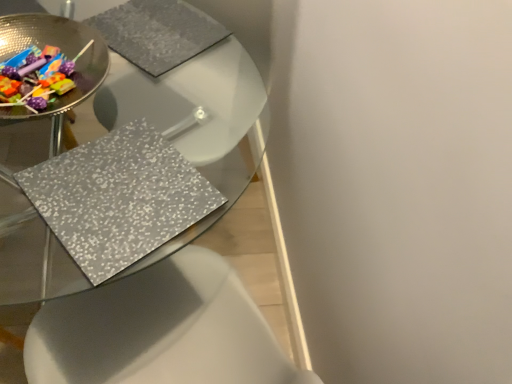
What are the coordinates of `shiny metallic bowl at upper left` in the screenshot? It's located at (61, 50).

What do you see at coordinates (61, 50) in the screenshot? Image resolution: width=512 pixels, height=384 pixels. I see `shiny metallic bowl at upper left` at bounding box center [61, 50].

The width and height of the screenshot is (512, 384). In order to click on metallic silver placemat at center in this screenshot , I will do click(184, 117).

This screenshot has height=384, width=512. What do you see at coordinates (184, 117) in the screenshot? I see `metallic silver placemat at center` at bounding box center [184, 117].

Locate an element on the screen. The image size is (512, 384). shiny metallic bowl at upper left is located at coordinates coord(61,50).

Between metallic silver placemat at center and shiny metallic bowl at upper left, which one appears on the right side from the viewer's perspective?

From the viewer's perspective, shiny metallic bowl at upper left appears more on the right side.

Does metallic silver placemat at center lie behind shiny metallic bowl at upper left?

No, it is not.

Considering the positions of point (224, 50) and point (71, 25), is point (224, 50) closer or farther from the camera than point (71, 25)?

Point (224, 50) appears to be farther away from the viewer than point (71, 25).

From the image's perspective, is metallic silver placemat at center located beneath shiny metallic bowl at upper left?

Yes, from the image's perspective, metallic silver placemat at center is below shiny metallic bowl at upper left.

From a real-world perspective, which object stands above the other?

From a 3D spatial view, shiny metallic bowl at upper left is above.

In terms of width, does metallic silver placemat at center look wider or thinner when compared to shiny metallic bowl at upper left?

In the image, metallic silver placemat at center appears to be wider than shiny metallic bowl at upper left.

From their relative heights in the image, would you say metallic silver placemat at center is taller or shorter than shiny metallic bowl at upper left?

metallic silver placemat at center is taller than shiny metallic bowl at upper left.

In terms of size, does metallic silver placemat at center appear bigger or smaller than shiny metallic bowl at upper left?

Clearly, metallic silver placemat at center is larger in size than shiny metallic bowl at upper left.

Do you think metallic silver placemat at center is within shiny metallic bowl at upper left, or outside of it?

metallic silver placemat at center is outside shiny metallic bowl at upper left.

Is metallic silver placemat at center far away from shiny metallic bowl at upper left?

No.

Does metallic silver placemat at center turn towards shiny metallic bowl at upper left?

No.

How different are the orientations of metallic silver placemat at center and shiny metallic bowl at upper left in degrees?

metallic silver placemat at center and shiny metallic bowl at upper left are facing 1.8 degrees away from each other.

You are a GUI agent. You are given a task and a screenshot of the screen. Output one action in this format:
    pyautogui.click(x=<x>, y=<y>)
    Task: Click on the table below the shiny metallic bowl at upper left (from a real-world perspective)
    This screenshot has height=384, width=512.
    Given the screenshot: What is the action you would take?
    pyautogui.click(x=184, y=117)

Considering the relative positions of shiny metallic bowl at upper left and metallic silver placemat at center in the image provided, is shiny metallic bowl at upper left to the right of metallic silver placemat at center from the viewer's perspective?

Correct, you'll find shiny metallic bowl at upper left to the right of metallic silver placemat at center.

Between shiny metallic bowl at upper left and metallic silver placemat at center, which one is positioned in front?

metallic silver placemat at center is more forward.

Considering the points (88, 82) and (42, 289), which point is in front, point (88, 82) or point (42, 289)?

The point (88, 82) is closer.

From the image's perspective, would you say shiny metallic bowl at upper left is shown under metallic silver placemat at center?

No, from the image's perspective, shiny metallic bowl at upper left is not beneath metallic silver placemat at center.

From a real-world perspective, is shiny metallic bowl at upper left on top of metallic silver placemat at center?

Indeed, from a real-world perspective, shiny metallic bowl at upper left stands above metallic silver placemat at center.

Between shiny metallic bowl at upper left and metallic silver placemat at center, which one has larger width?

Wider between the two is metallic silver placemat at center.

Between shiny metallic bowl at upper left and metallic silver placemat at center, which one has less height?

With less height is shiny metallic bowl at upper left.

Based on their sizes in the image, would you say shiny metallic bowl at upper left is bigger or smaller than metallic silver placemat at center?

Considering their sizes, shiny metallic bowl at upper left takes up less space than metallic silver placemat at center.

Is shiny metallic bowl at upper left completely or partially outside of metallic silver placemat at center?

shiny metallic bowl at upper left is positioned outside metallic silver placemat at center.

Is shiny metallic bowl at upper left with metallic silver placemat at center?

No, shiny metallic bowl at upper left is not next to metallic silver placemat at center.

Could you tell me if shiny metallic bowl at upper left is turned towards metallic silver placemat at center?

No.

What's the angular difference between shiny metallic bowl at upper left and metallic silver placemat at center's facing directions?

The angle between the facing direction of shiny metallic bowl at upper left and the facing direction of metallic silver placemat at center is 1.8 degrees.

How distant is shiny metallic bowl at upper left from metallic silver placemat at center?

The distance of shiny metallic bowl at upper left from metallic silver placemat at center is 16.52 inches.

At what (x,y) coordinates should I click in order to perform the action: click on table located on the left of shiny metallic bowl at upper left. Please return your answer as a coordinate pair (x, y). This screenshot has width=512, height=384. Looking at the image, I should click on (184, 117).

In order to click on table to the left of shiny metallic bowl at upper left in this screenshot , I will do (x=184, y=117).

Find the location of `table directly beneath the shiny metallic bowl at upper left (from a real-world perspective)`. table directly beneath the shiny metallic bowl at upper left (from a real-world perspective) is located at coordinates (184, 117).